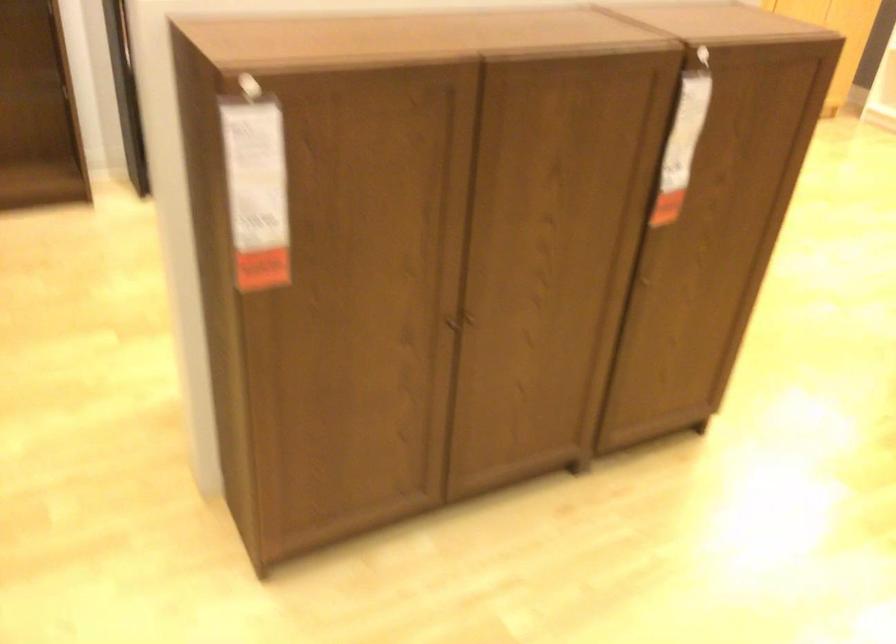
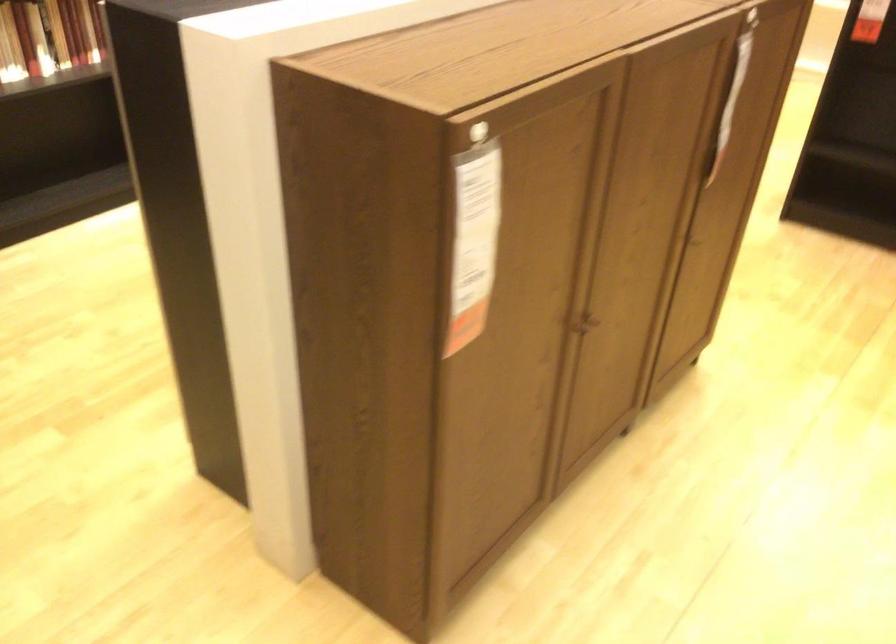
Where in the second image is the point corresponding to the point at 252,185 from the first image?

(474, 242)